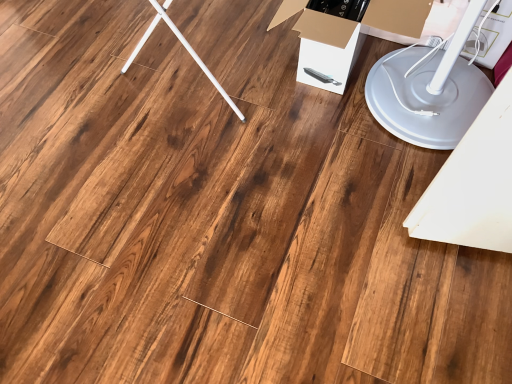
Question: In terms of width, does white plastic lift at lower right look wider or thinner when compared to white cardboard box at center?

Choices:
 (A) thin
 (B) wide

Answer: (B)

Question: Relative to white cardboard box at center, is white plastic lift at lower right in front or behind?

Choices:
 (A) behind
 (B) front

Answer: (B)

Question: From a real-world perspective, is white plastic lift at lower right physically located above or below white cardboard box at center?

Choices:
 (A) above
 (B) below

Answer: (A)

Question: Based on their sizes in the image, would you say white cardboard box at center is bigger or smaller than white plastic lift at lower right?

Choices:
 (A) big
 (B) small

Answer: (B)

Question: From the image's perspective, relative to white plastic lift at lower right, is white cardboard box at center above or below?

Choices:
 (A) above
 (B) below

Answer: (A)

Question: From their relative heights in the image, would you say white cardboard box at center is taller or shorter than white plastic lift at lower right?

Choices:
 (A) tall
 (B) short

Answer: (B)

Question: Does point (308, 64) appear closer or farther from the camera than point (431, 74)?

Choices:
 (A) closer
 (B) farther

Answer: (A)